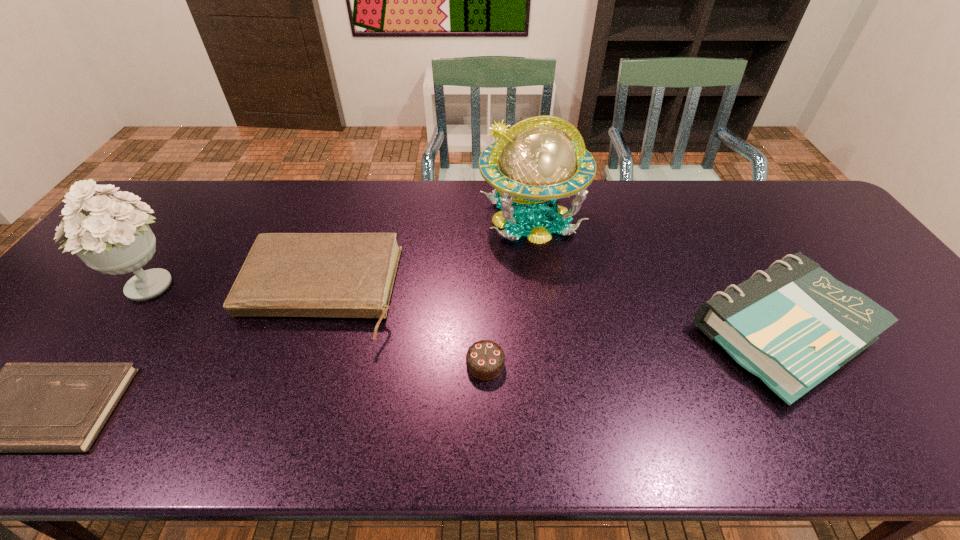
At what (x,y) coordinates should I click in order to perform the action: click on globe. Please return your answer as a coordinate pair (x, y). The width and height of the screenshot is (960, 540). Looking at the image, I should click on point(538,164).

I want to click on bouquet, so click(115, 238).

Find the location of `the third tallest object`. the third tallest object is located at coordinates (792, 325).

I want to click on the rightmost paperback book, so click(792, 325).

Where is `the third object from left to right`? Image resolution: width=960 pixels, height=540 pixels. the third object from left to right is located at coordinates (345, 275).

The width and height of the screenshot is (960, 540). What are the coordinates of `the second tallest paperback book` in the screenshot? It's located at (345, 275).

Identify the location of chocolate cake. (485, 359).

Where is `blank space located 0.360m on the left of the globe`? The image size is (960, 540). blank space located 0.360m on the left of the globe is located at coordinates (365, 218).

Identify the location of free space located on the front of the bouquet. (80, 381).

Locate an element on the screen. Image resolution: width=960 pixels, height=540 pixels. vacant space located on the back of the tallest paperback book is located at coordinates click(x=730, y=248).